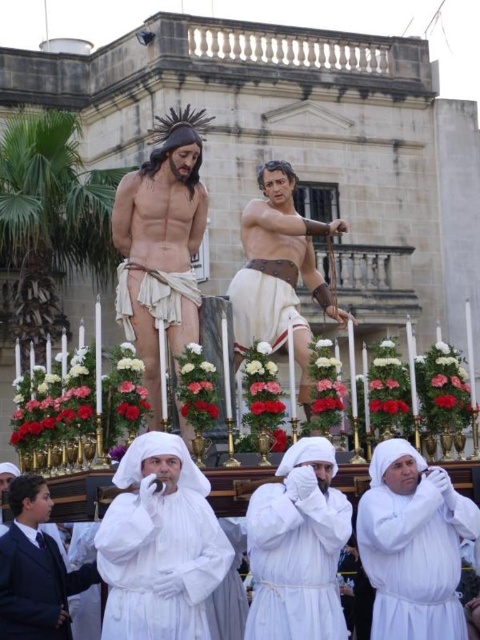
You are a photographer at the Holy Week procession. You need to capture a photo where both the white matte robe at center and the white cotton robe at lower center are clearly visible. Which robe should you focus on first to ensure both are in frame?

The white matte robe at center is not as tall as the white cotton robe at lower center. Therefore, you should focus on the taller white cotton robe at lower center first to ensure the shorter white matte robe at center remains in frame.

Based on the scene description, what object is located at the central point marked by coordinates point (159, 545)?

The white cloth at center is located at point (159, 545).

You are a photographer standing at the back of the procession. You want to take a photo that includes both the white cloth at center and the white cotton robe at lower center. Given that your camera has a maximum focus range of 7 meters, will you be able to capture both objects in focus without moving closer?

The distance between the white cloth at center and the white cotton robe at lower center is 7.65 meters. Since your camera can only focus up to 7 meters, you wonwont be able to capture both objects in focus without moving closer.